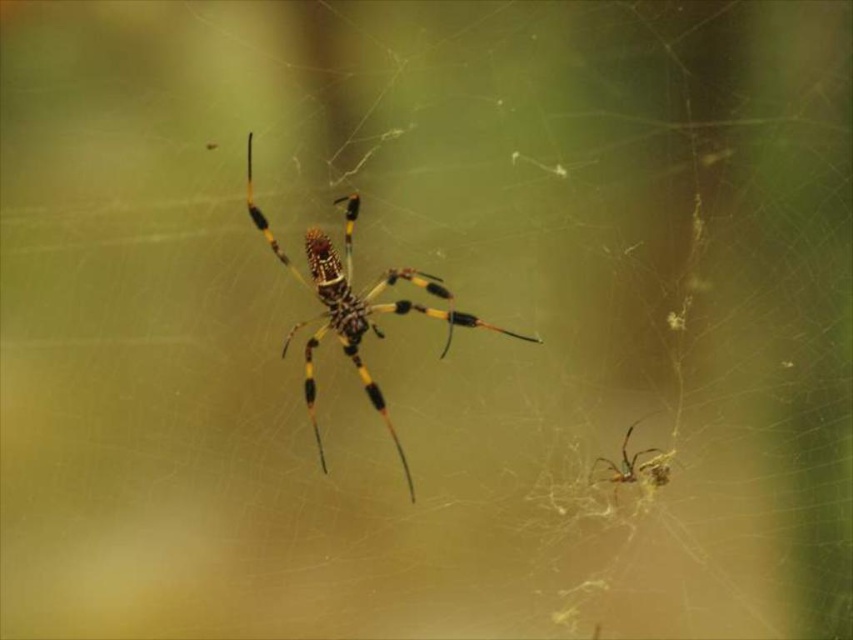
Can you confirm if yellow and black fuzzy spider at center is smaller than shiny metallic spider at lower right?

No.

Describe the element at coordinates (355, 307) in the screenshot. I see `yellow and black fuzzy spider at center` at that location.

Does point (527, 340) come in front of point (654, 451)?

No, (527, 340) is behind (654, 451).

Where is `yellow and black fuzzy spider at center`? The height and width of the screenshot is (640, 853). yellow and black fuzzy spider at center is located at coordinates (355, 307).